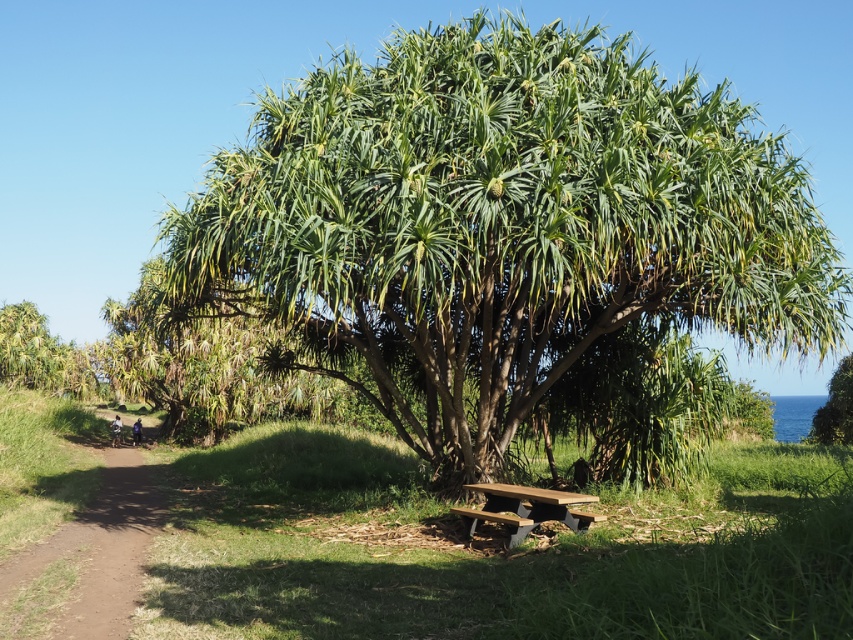
You are planning to walk along the brown dirt path at lower left while avoiding the green leafy tree at right. Based on the scene, is the path wide enough to walk on without getting too close to the tree?

The brown dirt path at lower left might be wider than green leafy tree at right, so it is likely wide enough to walk on without getting too close to the tree.

You are planning to set up a tent in the area shown. The tent requires a flat surface that is at least as tall as the green leafy tree at right. Can the brown dirt path at lower left provide a suitable location for the tent based on height requirements?

The brown dirt path at lower left is not as tall as the green leafy tree at right, so it does not meet the height requirement for the tent. Choose another location.

You are planning to set up a tent for a small gathering under the green leafy tree at right. Considering the brown wooden picnic table at lower center is in the way, can you estimate whether the tree is tall enough to accommodate the tent without the table blocking the shade?

The brown wooden picnic table at lower center has a lesser height compared to the green leafy tree at right, so the tree is taller than the table. This means the tree should provide sufficient shade over the picnic table area, allowing you to set up the tent without obstruction from the table.